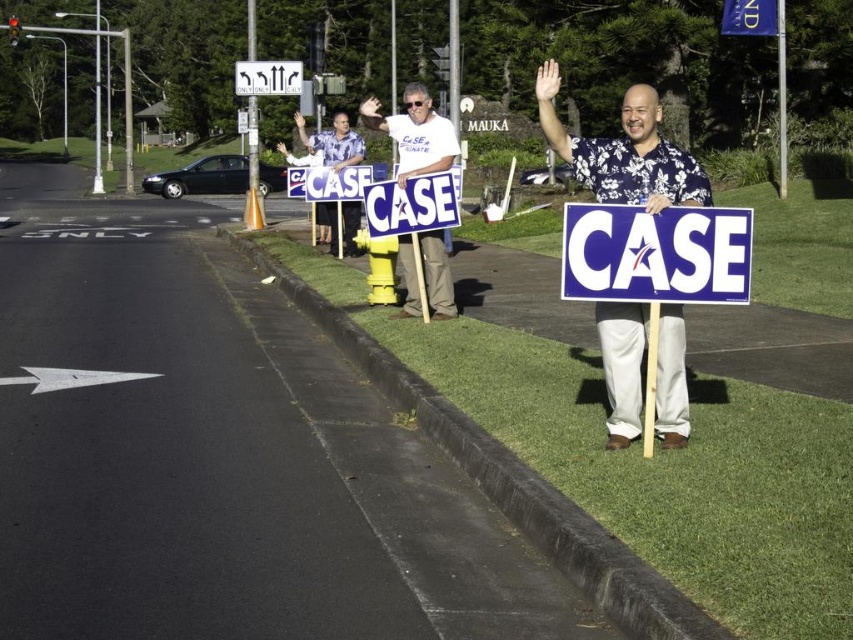
Does white cotton shirt at center appear over white plastic sign at upper center?

No, white cotton shirt at center is not above white plastic sign at upper center.

Measure the distance between point (433,260) and camera.

A distance of 9.63 meters exists between point (433,260) and camera.

You are a GUI agent. You are given a task and a screenshot of the screen. Output one action in this format:
    pyautogui.click(x=<x>, y=<y>)
    Task: Click on the white cotton shirt at center
    The width and height of the screenshot is (853, 640).
    Given the screenshot: What is the action you would take?
    pyautogui.click(x=415, y=132)

Does white plastic sign at center have a smaller size compared to white cotton shirt at center?

Indeed, white plastic sign at center has a smaller size compared to white cotton shirt at center.

Does white plastic sign at center have a lesser height compared to white cotton shirt at center?

Correct, white plastic sign at center is not as tall as white cotton shirt at center.

Is point (585, 236) closer to viewer compared to point (373, 129)?

Yes, it is.

Find the location of a particular element. Image resolution: width=853 pixels, height=640 pixels. white plastic sign at center is located at coordinates (656, 253).

Describe the element at coordinates (624, 152) in the screenshot. I see `blue floral shirt at center` at that location.

Is point (645, 337) closer to viewer compared to point (434, 196)?

Yes, point (645, 337) is closer to viewer.

Find the location of a particular element. The image size is (853, 640). blue floral shirt at center is located at coordinates (624, 152).